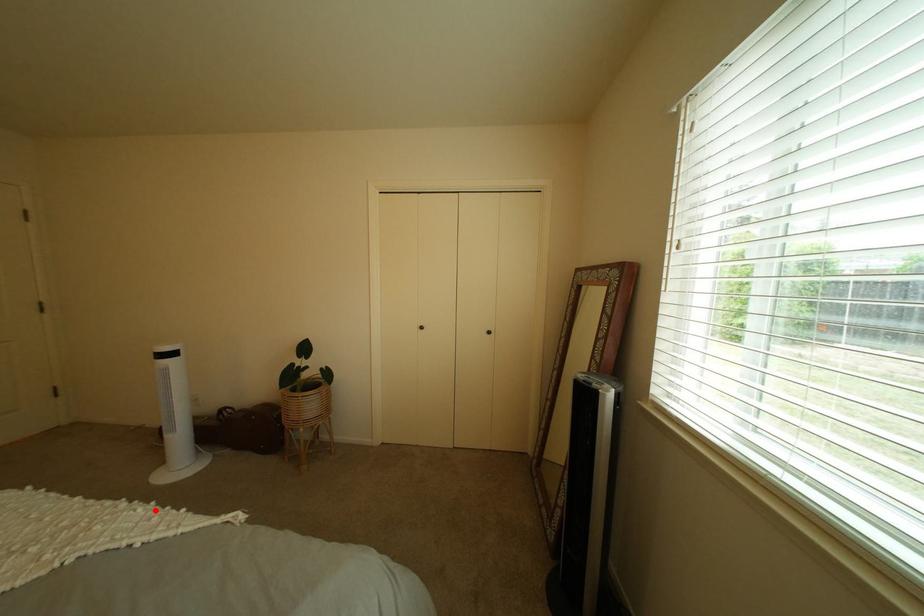
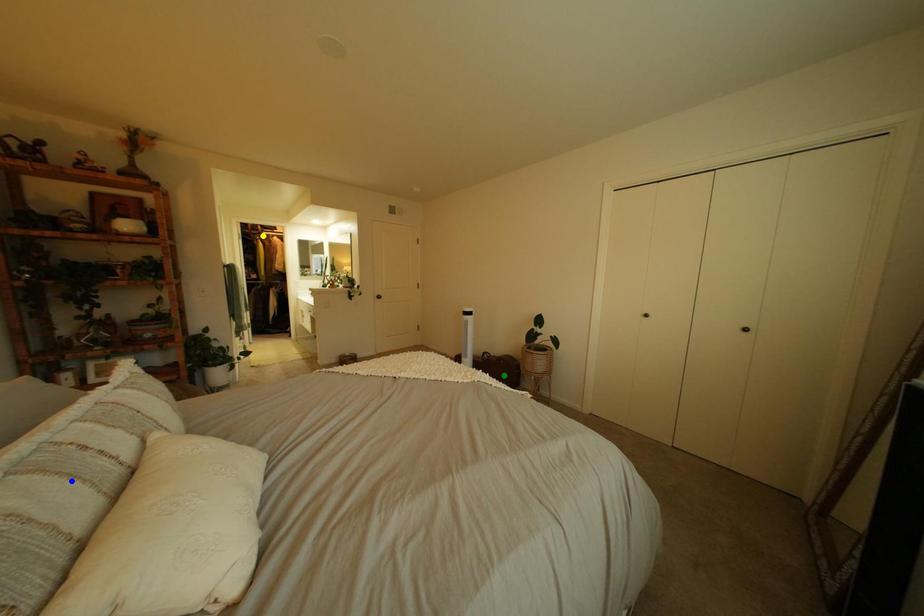
Question: I am providing you with two images of the same scene from different viewpoints. A red point is marked on the first image. You are given multiple points on the second image. Which point in image 2 represents the same 3d spot as the red point in image 1?

Choices:
 (A) blue point
 (B) green point
 (C) yellow point

Answer: (B)